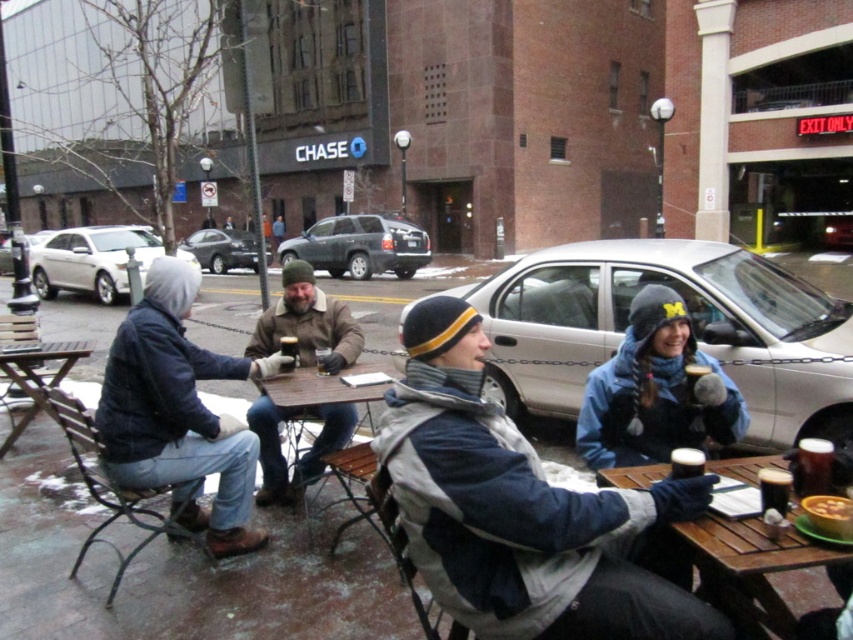
Between point (207, 257) and point (779, 476), which one is positioned in front?

Point (779, 476) is more forward.

Between point (267, 248) and point (790, 484), which one is positioned behind?

The point (267, 248) is more distant.

Identify the location of satin black suv at center. (222, 250).

Is satin black suv at center to the left of smooth yellow soup at lower right from the viewer's perspective?

Indeed, satin black suv at center is positioned on the left side of smooth yellow soup at lower right.

Which is below, satin black suv at center or smooth yellow soup at lower right?

smooth yellow soup at lower right is below.

Locate an element on the screen. The image size is (853, 640). satin black suv at center is located at coordinates (222, 250).

Does wooden table at left appear over matte plastic cup at center?

No, wooden table at left is not above matte plastic cup at center.

Is wooden table at left smaller than matte plastic cup at center?

No, wooden table at left is not smaller than matte plastic cup at center.

I want to click on wooden table at left, so tap(38, 376).